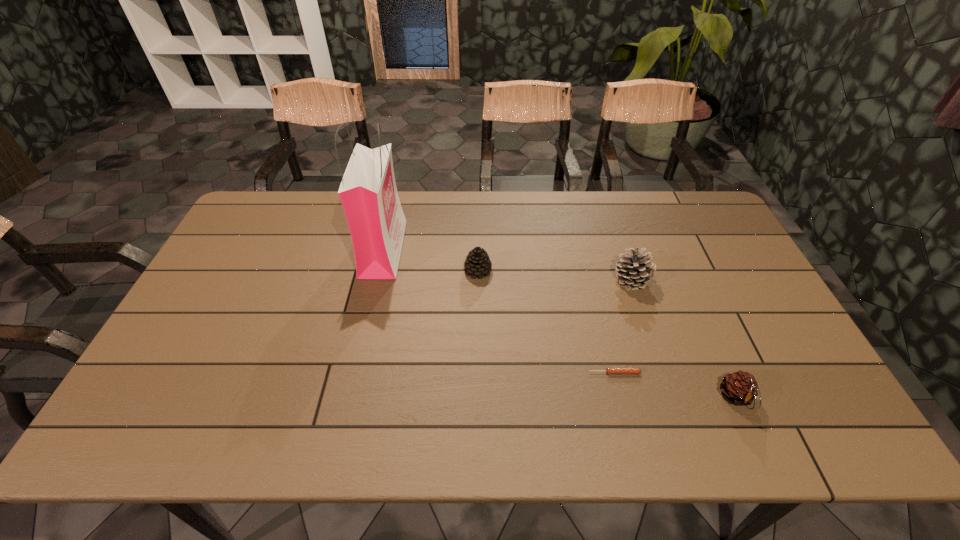
The image size is (960, 540). I want to click on vacant space located on the back of the tallest pinecone, so click(623, 253).

Image resolution: width=960 pixels, height=540 pixels. I want to click on vacant point located 0.330m at the narrow end of the leftmost pinecone, so click(x=599, y=271).

Locate an element on the screen. free space located on the front of the second nearest object is located at coordinates (620, 397).

Where is `object that is at the far edge`? The height and width of the screenshot is (540, 960). object that is at the far edge is located at coordinates (368, 192).

Where is `object present at the near edge`? The image size is (960, 540). object present at the near edge is located at coordinates (740, 388).

In order to click on free space at the far edge of the desktop in this screenshot , I will do `click(415, 201)`.

In the image, there is a desktop. At what (x,y) coordinates should I click in order to perform the action: click on blank space at the near edge. Please return your answer as a coordinate pair (x, y). Looking at the image, I should click on 752,415.

At what (x,y) coordinates should I click in order to perform the action: click on vacant space at the left edge of the desktop. Please return your answer as a coordinate pair (x, y). Looking at the image, I should click on click(x=177, y=382).

I want to click on vacant area at the far left corner of the desktop, so click(x=275, y=192).

The image size is (960, 540). I want to click on vacant point located between the fourth farthest object and the rightmost object, so click(675, 385).